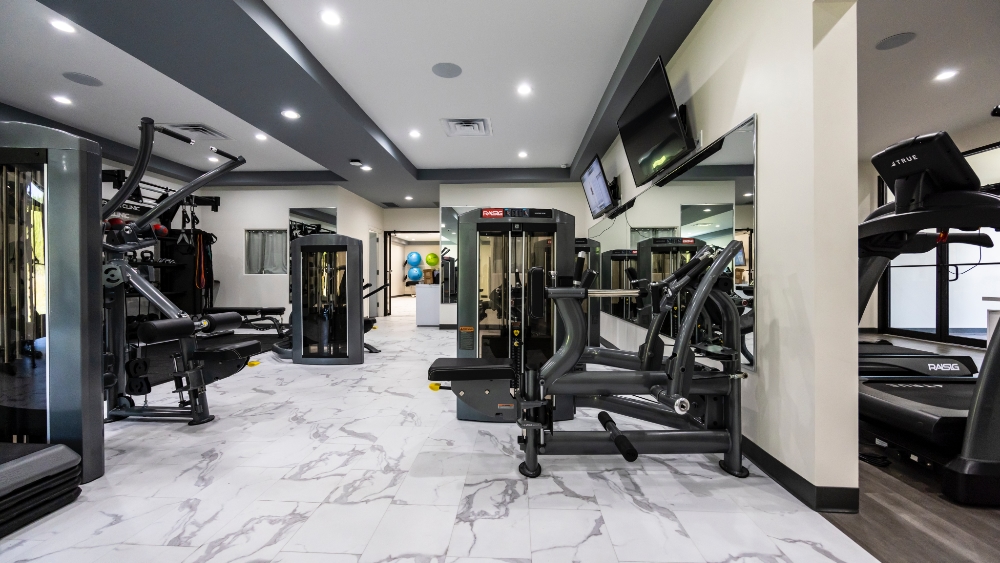
Identify the location of tile flooring. The image size is (1000, 563). (359, 433).